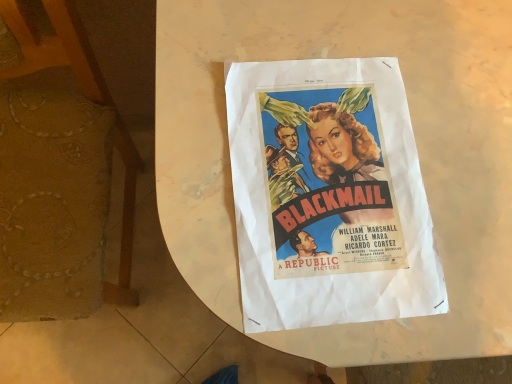
The height and width of the screenshot is (384, 512). Describe the element at coordinates (328, 195) in the screenshot. I see `matte paper poster at center` at that location.

This screenshot has width=512, height=384. Find the location of `matte paper poster at center`. matte paper poster at center is located at coordinates (328, 195).

Locate an element on the screen. The image size is (512, 384). wooden at left is located at coordinates (60, 173).

This screenshot has height=384, width=512. What do you see at coordinates (60, 173) in the screenshot?
I see `wooden at left` at bounding box center [60, 173].

What is the approximate height of wooden at left?

wooden at left is 85.98 centimeters in height.

At what (x,y) coordinates should I click in order to perform the action: click on matte paper poster at center. Please return your answer as a coordinate pair (x, y). The height and width of the screenshot is (384, 512). Looking at the image, I should click on (328, 195).

Looking at this image, considering the relative positions of wooden at left and matte paper poster at center in the image provided, is wooden at left to the left or to the right of matte paper poster at center?

In the image, wooden at left appears on the left side of matte paper poster at center.

In the image, is wooden at left positioned in front of or behind matte paper poster at center?

Visually, wooden at left is located in front of matte paper poster at center.

Is point (96, 284) less distant than point (245, 67)?

That is False.

From the image's perspective, is wooden at left above matte paper poster at center?

Indeed, from the image's perspective, wooden at left is shown above matte paper poster at center.

Based on the photo, from a real-world perspective, is wooden at left over matte paper poster at center?

Actually, wooden at left is physically below matte paper poster at center in the real world.

Which object is thinner, wooden at left or matte paper poster at center?

matte paper poster at center.

Considering the relative sizes of wooden at left and matte paper poster at center in the image provided, is wooden at left taller than matte paper poster at center?

Correct, wooden at left is much taller as matte paper poster at center.

Is wooden at left bigger than matte paper poster at center?

Indeed, wooden at left has a larger size compared to matte paper poster at center.

Is wooden at left located outside matte paper poster at center?

Yes, wooden at left is located beyond the bounds of matte paper poster at center.

Is wooden at left far away from matte paper poster at center?

No, wooden at left is not far away from matte paper poster at center.

Is matte paper poster at center at the back of wooden at left?

No, wooden at left is not facing away from matte paper poster at center.

From the picture: What's the angular difference between wooden at left and matte paper poster at center's facing directions?

wooden at left and matte paper poster at center are facing 5.21 degrees away from each other.

The width and height of the screenshot is (512, 384). In order to click on poster on the right of the wooden at left in this screenshot , I will do `click(328, 195)`.

Considering the relative positions of matte paper poster at center and wooden at left in the image provided, is matte paper poster at center to the left or to the right of wooden at left?

Clearly, matte paper poster at center is on the right of wooden at left in the image.

Is the position of matte paper poster at center less distant than that of wooden at left?

No, the depth of matte paper poster at center is greater than that of wooden at left.

Which is less distant, (x=261, y=131) or (x=29, y=71)?

Clearly, point (x=261, y=131) is closer to the camera than point (x=29, y=71).

From the image's perspective, is matte paper poster at center positioned above or below wooden at left?

matte paper poster at center is below wooden at left.

From a real-world perspective, is matte paper poster at center over wooden at left?

Correct, in the physical world, matte paper poster at center is higher than wooden at left.

Which object is thinner, matte paper poster at center or wooden at left?

matte paper poster at center.

Considering the relative sizes of matte paper poster at center and wooden at left in the image provided, is matte paper poster at center shorter than wooden at left?

Yes.

Who is bigger, matte paper poster at center or wooden at left?

wooden at left is bigger.

Can we say matte paper poster at center lies outside wooden at left?

matte paper poster at center lies outside wooden at left's area.

Would you consider matte paper poster at center to be distant from wooden at left?

matte paper poster at center is actually quite close to wooden at left.

Is matte paper poster at center facing away from wooden at left?

No, matte paper poster at center's orientation is not away from wooden at left.

What's the angular difference between matte paper poster at center and wooden at left's facing directions?

There is a 5.21-degree angle between the facing directions of matte paper poster at center and wooden at left.

Identify the location of armchair above the matte paper poster at center (from the image's perspective). (60, 173).

Image resolution: width=512 pixels, height=384 pixels. What are the coordinates of `poster lying on the right of wooden at left` in the screenshot? It's located at (328, 195).

This screenshot has height=384, width=512. Find the location of `poster that is above the wooden at left (from a real-world perspective)`. poster that is above the wooden at left (from a real-world perspective) is located at coordinates (328, 195).